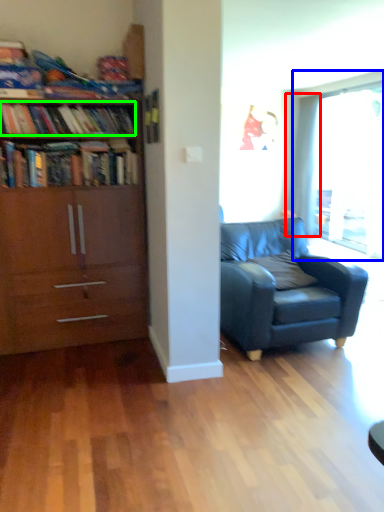
Question: Based on their relative distances, which object is farther from curtain (highlighted by a red box)? Choose from window (highlighted by a blue box) and book (highlighted by a green box).

Choices:
 (A) window
 (B) book

Answer: (B)